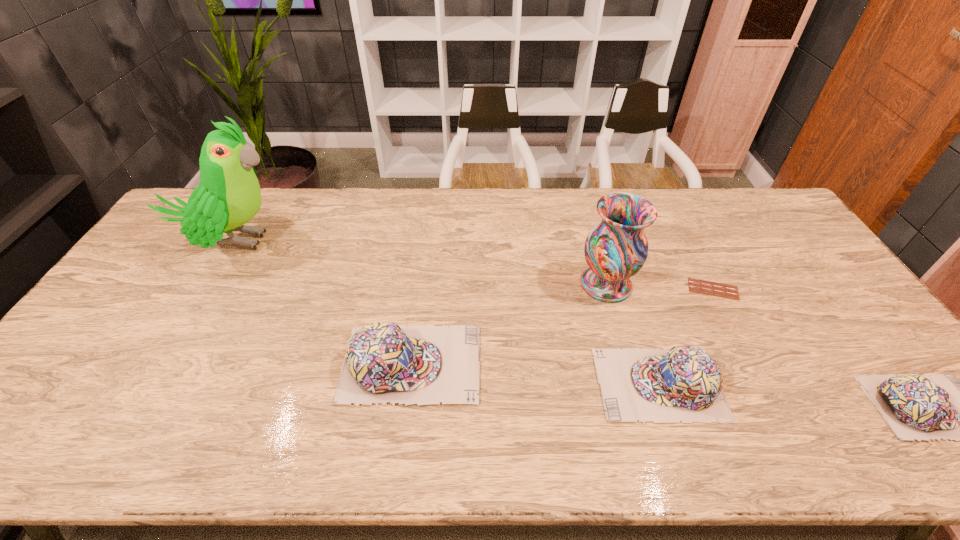
In the image, there is a desktop. Where is `vacant space at the right edge`? The image size is (960, 540). vacant space at the right edge is located at coordinates (854, 316).

Find the location of a particular element. Image resolution: width=960 pixels, height=540 pixels. free spot between the second tallest cap and the second object from right to left is located at coordinates (686, 336).

Where is `empty space that is in between the fourth tallest object and the leftmost object`? empty space that is in between the fourth tallest object and the leftmost object is located at coordinates (446, 313).

At what (x,y) coordinates should I click in order to perform the action: click on free spot between the second object from left to right and the second tallest object. Please return your answer as a coordinate pair (x, y). This screenshot has width=960, height=540. Looking at the image, I should click on (509, 324).

Find the location of a particular element. vacant space that's between the vase and the second cap from left to right is located at coordinates (633, 334).

Where is `vacant area that lies between the fifth object from left to right and the third shortest object`? Image resolution: width=960 pixels, height=540 pixels. vacant area that lies between the fifth object from left to right and the third shortest object is located at coordinates (686, 336).

Where is `free spot between the second tallest object and the leftmost cap`? The width and height of the screenshot is (960, 540). free spot between the second tallest object and the leftmost cap is located at coordinates (509, 324).

The image size is (960, 540). In order to click on free space between the fifth object from right to left and the vase in this screenshot , I will do `click(509, 324)`.

Select which object is the fifth closest to the second tallest object. Please provide its 2D coordinates. Your answer should be formatted as a tuple, i.e. [(x, y)], where the tuple contains the x and y coordinates of a point satisfying the conditions above.

[(228, 196)]

This screenshot has width=960, height=540. I want to click on object that ranks as the fifth closest to the chocolate bar, so click(228, 196).